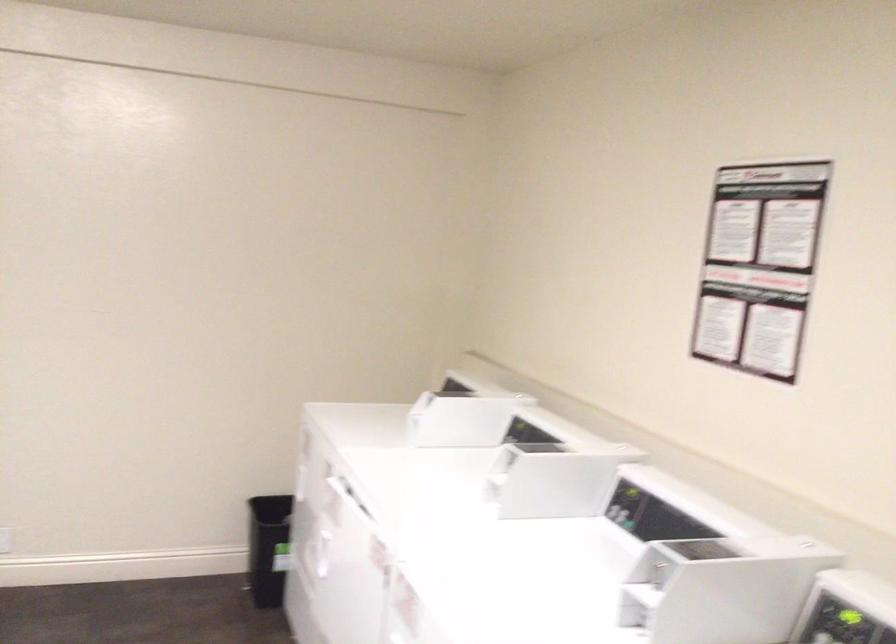
Where would you plac the black trash can? Please return your answer as a coordinate pair (x, y).

(268, 547)